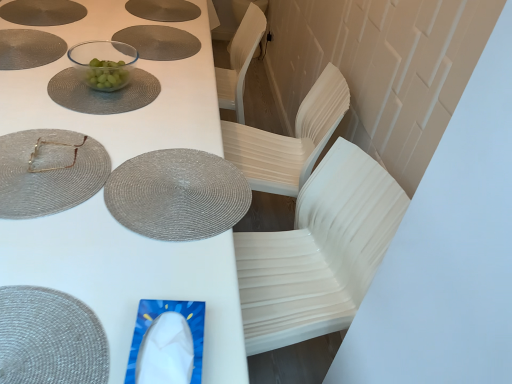
Image resolution: width=512 pixels, height=384 pixels. I want to click on free space between matte silver placemat at upper left, the 2th platter viewed from the right, and clear glass bowl at upper center, which appears as the fourth tableware when viewed from the front, so click(x=57, y=43).